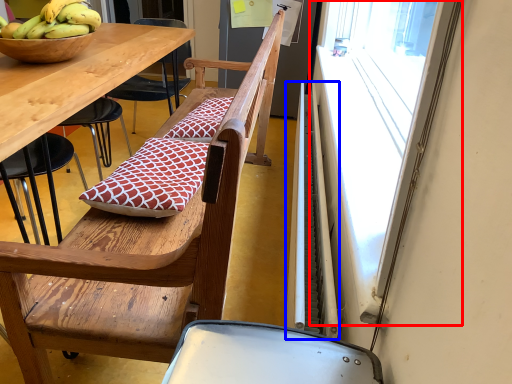
Question: Among these objects, which one is farthest to the camera, window screen (highlighted by a red box) or radiator (highlighted by a blue box)?

Choices:
 (A) window screen
 (B) radiator

Answer: (B)